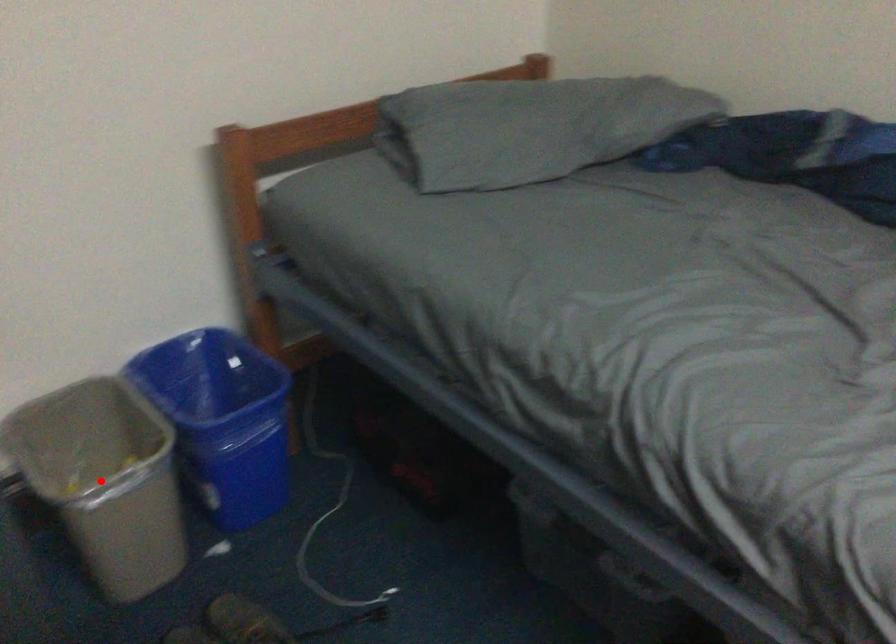
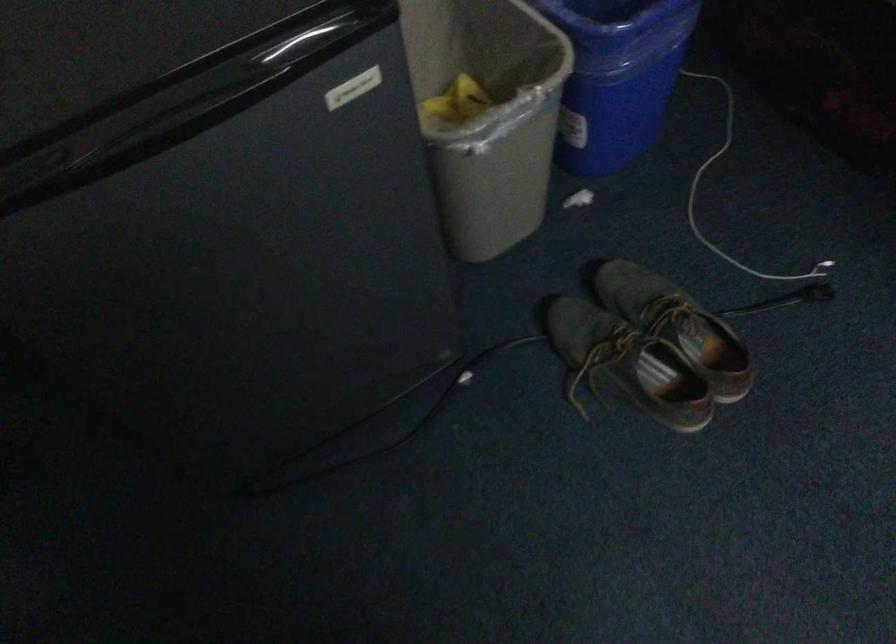
Question: I am providing you with two images of the same scene from different viewpoints. Given a red point in image1, look at the same physical point in image2. Is it:

Choices:
 (A) Closer to the viewpoint
 (B) Farther from the viewpoint

Answer: (A)